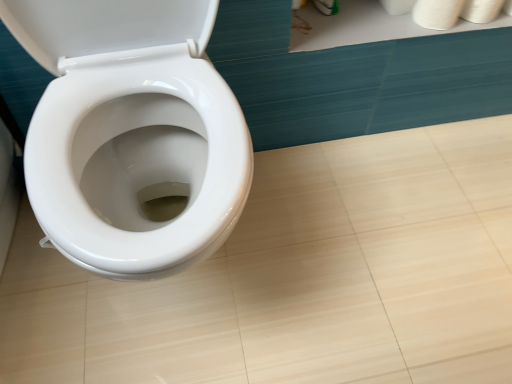
Question: Is white matte toilet paper at upper right, the 1th toilet paper when ordered from left to right, beside white matte toilet paper at upper right, marked as the second toilet paper in a right-to-left arrangement?

Choices:
 (A) no
 (B) yes

Answer: (B)

Question: From the image's perspective, does white matte toilet paper at upper right, the third toilet paper viewed from the right, appear higher than white matte toilet paper at upper right, the 2th toilet paper viewed from the left?

Choices:
 (A) yes
 (B) no

Answer: (A)

Question: Is white matte toilet paper at upper right, the third toilet paper viewed from the right, smaller than white matte toilet paper at upper right, the 2th toilet paper viewed from the left?

Choices:
 (A) no
 (B) yes

Answer: (B)

Question: Considering the relative sizes of white matte toilet paper at upper right, the third toilet paper viewed from the right, and white matte toilet paper at upper right, marked as the second toilet paper in a right-to-left arrangement, in the image provided, is white matte toilet paper at upper right, the third toilet paper viewed from the right, shorter than white matte toilet paper at upper right, marked as the second toilet paper in a right-to-left arrangement,?

Choices:
 (A) no
 (B) yes

Answer: (B)

Question: Is white matte toilet paper at upper right, the 1th toilet paper when ordered from left to right, thinner than white matte toilet paper at upper right, marked as the second toilet paper in a right-to-left arrangement?

Choices:
 (A) yes
 (B) no

Answer: (B)

Question: Relative to white matte toilet paper at upper right, acting as the 1th toilet paper starting from the right, is white matte toilet paper at upper right, the 2th toilet paper viewed from the left, in front or behind?

Choices:
 (A) behind
 (B) front

Answer: (B)

Question: Is white matte toilet paper at upper right, the 2th toilet paper viewed from the left, bigger or smaller than white matte toilet paper at upper right, the 3th toilet paper positioned from the left?

Choices:
 (A) small
 (B) big

Answer: (A)

Question: From their relative heights in the image, would you say white matte toilet paper at upper right, marked as the second toilet paper in a right-to-left arrangement, is taller or shorter than white matte toilet paper at upper right, acting as the 1th toilet paper starting from the right?

Choices:
 (A) short
 (B) tall

Answer: (B)

Question: Based on their positions, is white matte toilet paper at upper right, marked as the second toilet paper in a right-to-left arrangement, located to the left or right of white matte toilet paper at upper right, the 3th toilet paper positioned from the left?

Choices:
 (A) left
 (B) right

Answer: (A)

Question: From a real-world perspective, is white matte toilet paper at upper right, the 3th toilet paper positioned from the left, positioned above or below white matte toilet paper at upper right, the 2th toilet paper viewed from the left?

Choices:
 (A) below
 (B) above

Answer: (A)

Question: Considering the positions of white matte toilet paper at upper right, acting as the 1th toilet paper starting from the right, and white matte toilet paper at upper right, marked as the second toilet paper in a right-to-left arrangement, in the image, is white matte toilet paper at upper right, acting as the 1th toilet paper starting from the right, taller or shorter than white matte toilet paper at upper right, marked as the second toilet paper in a right-to-left arrangement,?

Choices:
 (A) tall
 (B) short

Answer: (B)

Question: In terms of width, does white matte toilet paper at upper right, acting as the 1th toilet paper starting from the right, look wider or thinner when compared to white matte toilet paper at upper right, the 2th toilet paper viewed from the left?

Choices:
 (A) thin
 (B) wide

Answer: (B)

Question: Based on their sizes in the image, would you say white matte toilet paper at upper right, the 3th toilet paper positioned from the left, is bigger or smaller than white matte toilet paper at upper right, marked as the second toilet paper in a right-to-left arrangement?

Choices:
 (A) big
 (B) small

Answer: (A)

Question: In terms of size, does white matte toilet paper at upper right, the 1th toilet paper when ordered from left to right, appear bigger or smaller than white matte toilet paper at upper right, the 3th toilet paper positioned from the left?

Choices:
 (A) big
 (B) small

Answer: (B)

Question: Is point (381, 0) positioned closer to the camera than point (463, 13)?

Choices:
 (A) closer
 (B) farther

Answer: (B)